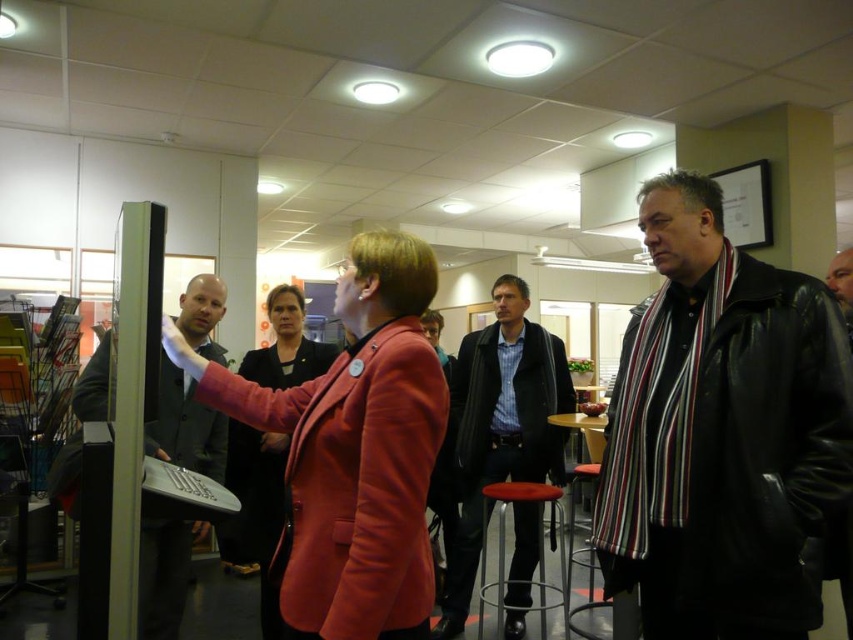
Is matte red blazer at center below dark blue shirt at center?

No.

Is point (405, 627) farther from camera compared to point (538, 448)?

No, it is not.

The image size is (853, 640). Describe the element at coordinates (352, 451) in the screenshot. I see `matte red blazer at center` at that location.

At what (x,y) coordinates should I click in order to perform the action: click on matte red blazer at center. Please return your answer as a coordinate pair (x, y). The width and height of the screenshot is (853, 640). Looking at the image, I should click on (352, 451).

Describe the element at coordinates (352, 451) in the screenshot. I see `matte red blazer at center` at that location.

At what (x,y) coordinates should I click in order to perform the action: click on matte red blazer at center. Please return your answer as a coordinate pair (x, y). This screenshot has height=640, width=853. Looking at the image, I should click on (352, 451).

Can you confirm if matte red blazer at center is shorter than metallic silver bar stool at center?

Yes.

The image size is (853, 640). What do you see at coordinates (352, 451) in the screenshot? I see `matte red blazer at center` at bounding box center [352, 451].

Is point (392, 369) more distant than point (514, 627)?

No, (392, 369) is in front of (514, 627).

The image size is (853, 640). Find the location of `matte red blazer at center`. matte red blazer at center is located at coordinates (352, 451).